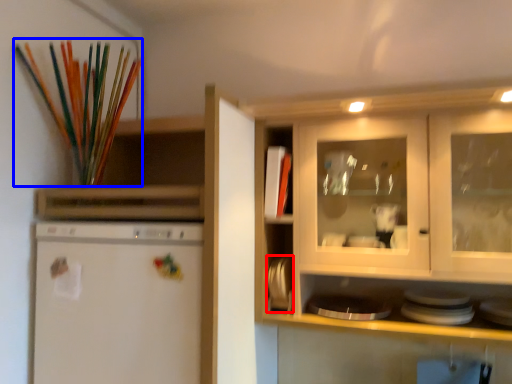
Question: Which point is closer to the camera, appliance (highlighted by a red box) or paint brush (highlighted by a blue box)?

Choices:
 (A) appliance
 (B) paint brush

Answer: (B)